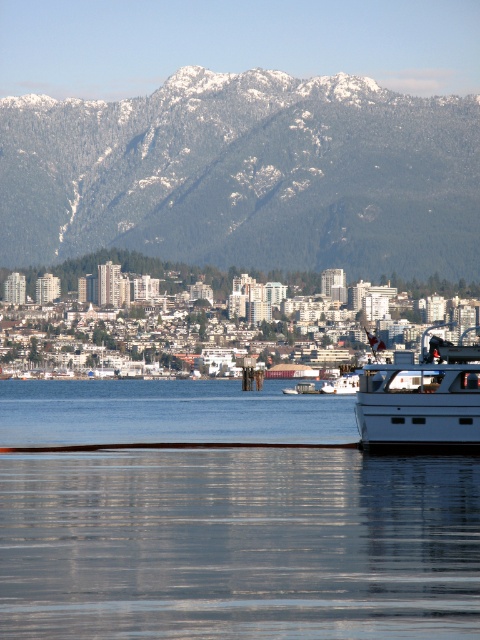
Consider the image. Which is above, snowy forested mountain at upper center or white matte boat at right?

snowy forested mountain at upper center is higher up.

Does snowy forested mountain at upper center have a greater width compared to white matte boat at right?

Correct, the width of snowy forested mountain at upper center exceeds that of white matte boat at right.

Is point (4, 216) more distant than point (455, 348)?

Yes, it is.

Locate an element on the screen. snowy forested mountain at upper center is located at coordinates (247, 173).